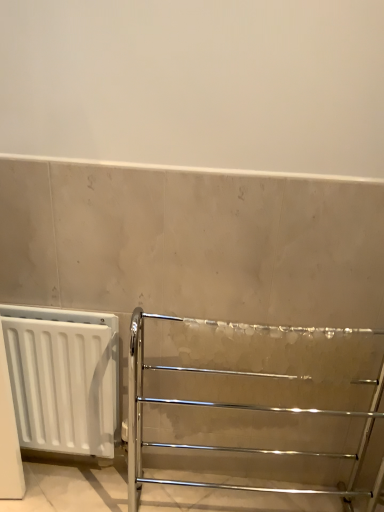
Locate an element on the screen. polished chrome towel rack at center is located at coordinates (256, 405).

Image resolution: width=384 pixels, height=512 pixels. Describe the element at coordinates (256, 405) in the screenshot. I see `polished chrome towel rack at center` at that location.

The width and height of the screenshot is (384, 512). What do you see at coordinates (64, 378) in the screenshot? I see `white matte radiator at left` at bounding box center [64, 378].

At what (x,y) coordinates should I click in order to perform the action: click on white matte radiator at left. Please return your answer as a coordinate pair (x, y). This screenshot has width=384, height=512. Looking at the image, I should click on (64, 378).

At what (x,y) coordinates should I click in order to perform the action: click on polished chrome towel rack at center. Please return your answer as a coordinate pair (x, y). Looking at the image, I should click on (256, 405).

Based on the photo, can you confirm if white matte radiator at left is positioned to the left of polished chrome towel rack at center?

Yes.

Is the position of white matte radiator at left less distant than that of polished chrome towel rack at center?

No, it is not.

Is point (36, 327) farther from camera compared to point (208, 442)?

No, (36, 327) is closer to viewer.

From the image's perspective, who appears lower, white matte radiator at left or polished chrome towel rack at center?

polished chrome towel rack at center.

From a real-world perspective, relative to polished chrome towel rack at center, is white matte radiator at left vertically above or below?

In terms of real-world spatial position, white matte radiator at left is below polished chrome towel rack at center.

Based on the photo, between white matte radiator at left and polished chrome towel rack at center, which one has larger width?

polished chrome towel rack at center.

Considering the sizes of objects white matte radiator at left and polished chrome towel rack at center in the image provided, who is taller, white matte radiator at left or polished chrome towel rack at center?

With more height is polished chrome towel rack at center.

Who is smaller, white matte radiator at left or polished chrome towel rack at center?

Smaller between the two is white matte radiator at left.

Looking at this image, is white matte radiator at left not inside polished chrome towel rack at center?

white matte radiator at left is positioned outside polished chrome towel rack at center.

Is white matte radiator at left positioned far away from polished chrome towel rack at center?

white matte radiator at left is actually quite close to polished chrome towel rack at center.

Could you tell me if white matte radiator at left is facing polished chrome towel rack at center?

No, white matte radiator at left is not turned towards polished chrome towel rack at center.

How different are the orientations of white matte radiator at left and polished chrome towel rack at center in degrees?

There is a 2.97-degree angle between the facing directions of white matte radiator at left and polished chrome towel rack at center.

You are a GUI agent. You are given a task and a screenshot of the screen. Output one action in this format:
    pyautogui.click(x=<x>, y=<y>)
    Task: Click on the furniture below the white matte radiator at left (from the image's perspective)
    
    Given the screenshot: What is the action you would take?
    pyautogui.click(x=256, y=405)

Considering the relative positions of polished chrome towel rack at center and white matte radiator at left in the image provided, is polished chrome towel rack at center to the right of white matte radiator at left from the viewer's perspective?

Indeed, polished chrome towel rack at center is positioned on the right side of white matte radiator at left.

In the image, is polished chrome towel rack at center positioned in front of or behind white matte radiator at left?

polished chrome towel rack at center is in front of white matte radiator at left.

Consider the image. Which point is more distant from viewer, (298,488) or (65,428)?

The point (298,488) is farther.

From the image's perspective, relative to white matte radiator at left, is polished chrome towel rack at center above or below?

Clearly, from the image's perspective, polished chrome towel rack at center is below white matte radiator at left.

From a real-world perspective, is polished chrome towel rack at center physically below white matte radiator at left?

No, from a real-world perspective, polished chrome towel rack at center is not under white matte radiator at left.

Which of these two, polished chrome towel rack at center or white matte radiator at left, is wider?

polished chrome towel rack at center is wider.

Between polished chrome towel rack at center and white matte radiator at left, which one has less height?

With less height is white matte radiator at left.

Which of these two, polished chrome towel rack at center or white matte radiator at left, is smaller?

With smaller size is white matte radiator at left.

Is polished chrome towel rack at center positioned beyond the bounds of white matte radiator at left?

Absolutely, polished chrome towel rack at center is external to white matte radiator at left.

Is polished chrome towel rack at center placed right next to white matte radiator at left?

No, polished chrome towel rack at center is not beside white matte radiator at left.

Does polished chrome towel rack at center turn towards white matte radiator at left?

No.

In the scene shown: What's the angular difference between polished chrome towel rack at center and white matte radiator at left's facing directions?

They differ by 2.97 degrees in their facing directions.

You are a GUI agent. You are given a task and a screenshot of the screen. Output one action in this format:
    pyautogui.click(x=<x>, y=<y>)
    Task: Click on the radiator behind the polished chrome towel rack at center
    This screenshot has height=512, width=384.
    Given the screenshot: What is the action you would take?
    pyautogui.click(x=64, y=378)

Where is `radiator on the left of polished chrome towel rack at center`? radiator on the left of polished chrome towel rack at center is located at coordinates (64, 378).

Where is `furniture in front of the white matte radiator at left`? furniture in front of the white matte radiator at left is located at coordinates (256, 405).